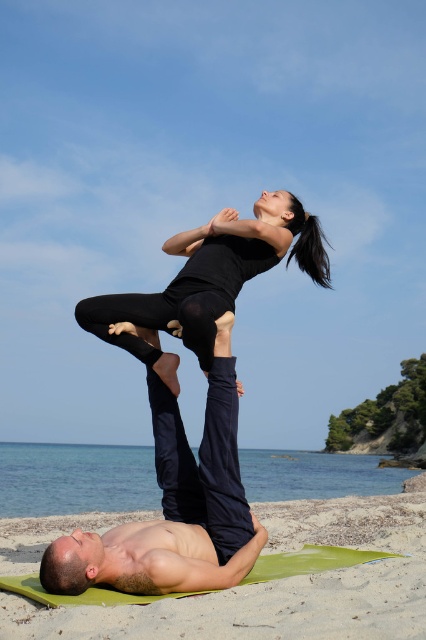
Question: Estimate the real-world distances between objects in this image. Which object is farther from the sandy beach at lower center?

Choices:
 (A) smooth black pants at center
 (B) black matte yoga pants at upper center

Answer: (B)

Question: Which point is farther to the camera?

Choices:
 (A) smooth black pants at center
 (B) sandy beach at lower center

Answer: (A)

Question: Can you confirm if sandy beach at lower center is positioned above black matte yoga pants at upper center?

Choices:
 (A) no
 (B) yes

Answer: (A)

Question: Can you confirm if sandy beach at lower center is thinner than smooth black pants at center?

Choices:
 (A) yes
 (B) no

Answer: (B)

Question: In this image, where is sandy beach at lower center located relative to black matte yoga pants at upper center?

Choices:
 (A) right
 (B) left

Answer: (B)

Question: Which of the following is the farthest from the observer?

Choices:
 (A) sandy beach at lower center
 (B) black matte yoga pants at upper center
 (C) smooth black pants at center

Answer: (B)